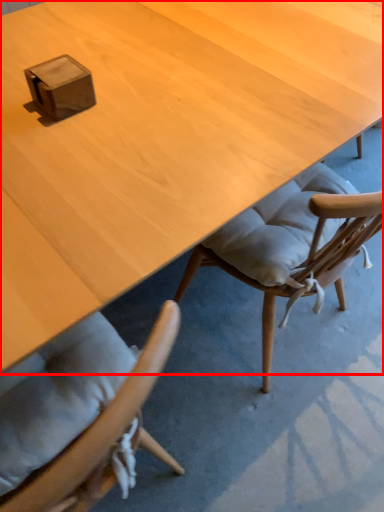
Question: From the image's perspective, where is desk (annotated by the red box) located in relation to box in the image?

Choices:
 (A) above
 (B) below

Answer: (B)